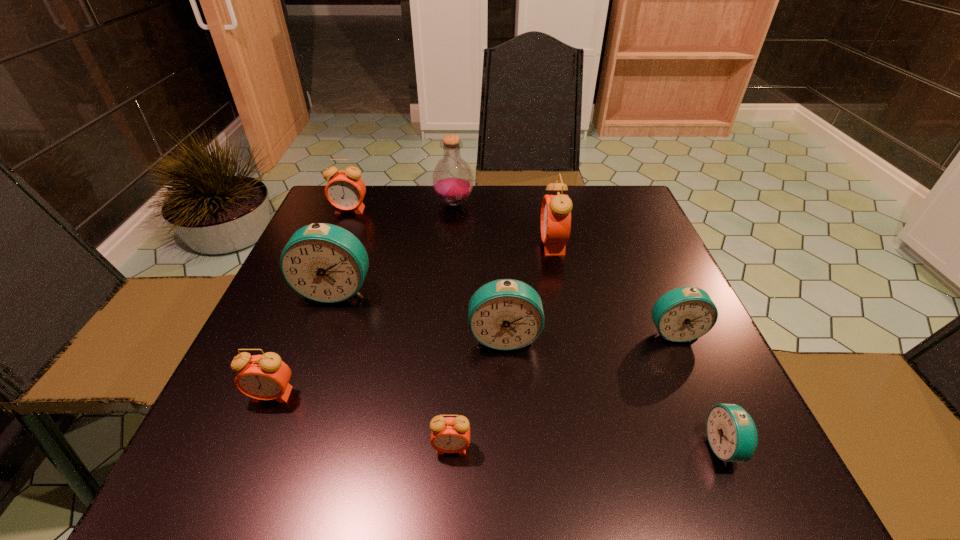
Select which blue alarm clock is the second closest to the second biggest blue alarm clock. Please provide its 2D coordinates. Your answer should be formatted as a tuple, i.e. [(x, y)], where the tuple contains the x and y coordinates of a point satisfying the conditions above.

[(325, 263)]

Where is `free region that satisfies the following two spatial constraints: 1. on the front-facing side of the smallest blue alarm clock; 2. on the face of the third pink alarm clock from left to right`? free region that satisfies the following two spatial constraints: 1. on the front-facing side of the smallest blue alarm clock; 2. on the face of the third pink alarm clock from left to right is located at coordinates (725, 448).